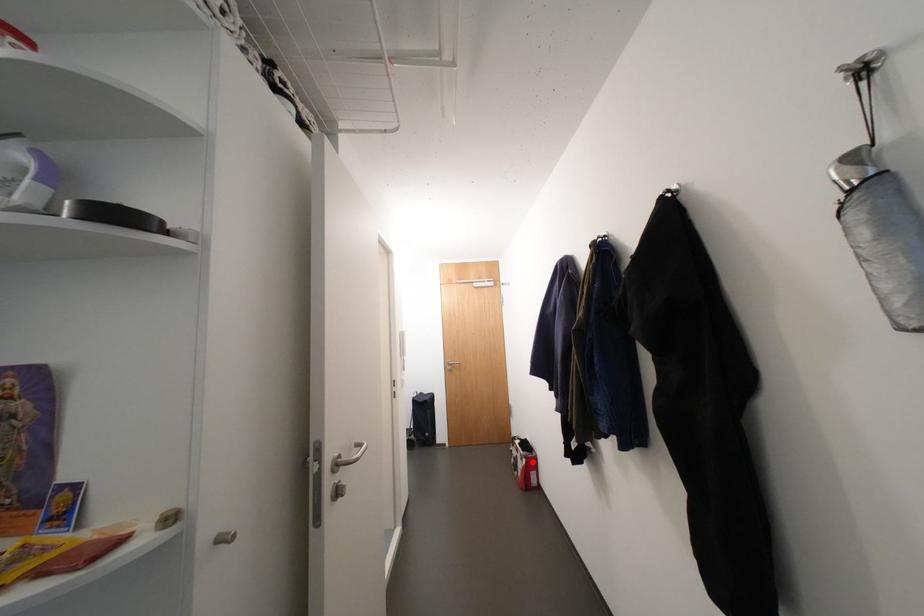
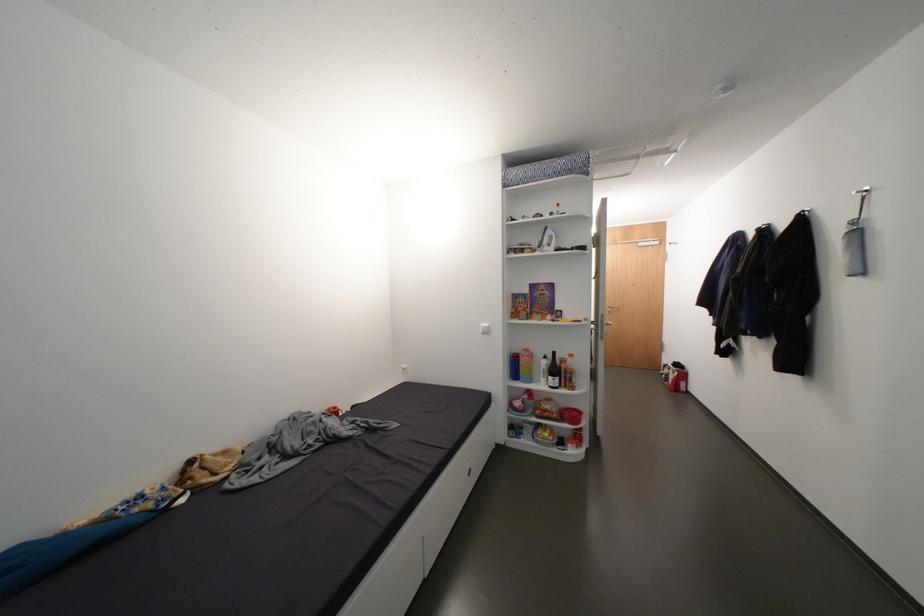
Question: I am providing you with two images of the same scene from different viewpoints. Given a red point in image1, look at the same physical point in image2. Is it:

Choices:
 (A) Closer to the viewpoint
 (B) Farther from the viewpoint

Answer: (A)